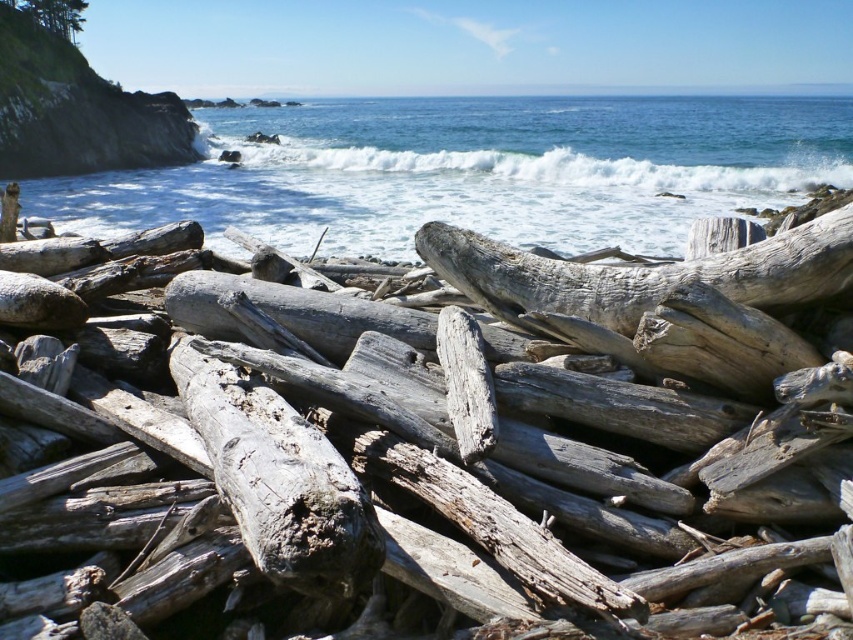
Is blue water at upper center to the left of weathered wood log at center from the viewer's perspective?

In fact, blue water at upper center is to the right of weathered wood log at center.

This screenshot has width=853, height=640. I want to click on blue water at upper center, so 474,172.

Is point (508, 243) more distant than point (521, 280)?

Yes, point (508, 243) is behind point (521, 280).

At what (x,y) coordinates should I click in order to perform the action: click on blue water at upper center. Please return your answer as a coordinate pair (x, y). The width and height of the screenshot is (853, 640). Looking at the image, I should click on pos(474,172).

Between blue water at upper center and white frothy wave at upper center, which one has less height?

With less height is white frothy wave at upper center.

Does blue water at upper center come in front of white frothy wave at upper center?

Yes, it is in front of white frothy wave at upper center.

Find the location of a particular element. This screenshot has height=640, width=853. blue water at upper center is located at coordinates click(x=474, y=172).

Where is `blue water at upper center`? The width and height of the screenshot is (853, 640). blue water at upper center is located at coordinates (474, 172).

Is weathered wood at center above blue water at upper center?

No, weathered wood at center is not above blue water at upper center.

Is point (614, 404) positioned behind point (463, 225)?

That is False.

Which is behind, point (160, 419) or point (215, 205)?

Point (215, 205)

What are the coordinates of `weathered wood at center` in the screenshot? It's located at point(403,458).